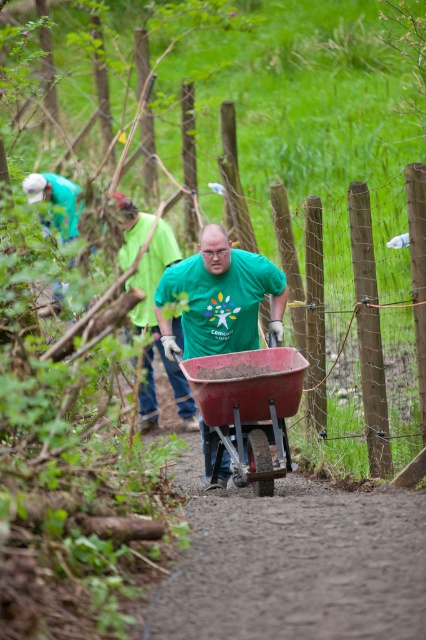
You are standing at the camera position and want to throw a ball to one of the two points in the scene. Which point, point (213, 481) or point (166, 252), is closer to you?

Point (213, 481) is closer to the camera than point (166, 252).

You are standing at the camera position and want to place a marker on the point that is closer to you. Which point should you choose between point (230, 268) and point (166, 260)?

Point (230, 268) is closer to the camera than point (166, 260), so you should choose point (230, 268).